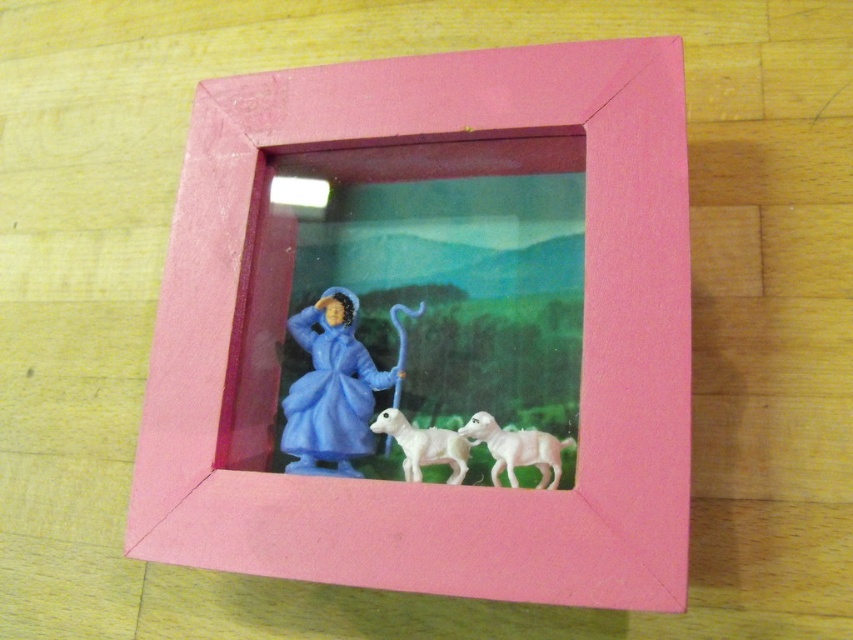
Describe the element at coordinates (289, 285) in the screenshot. I see `pink wood frame at center` at that location.

Is pink wood frame at center to the left of blue plastic figurine at center from the viewer's perspective?

Incorrect, pink wood frame at center is not on the left side of blue plastic figurine at center.

Find the location of a particular element. Image resolution: width=853 pixels, height=640 pixels. pink wood frame at center is located at coordinates (289, 285).

Where is `pink wood frame at center`? The height and width of the screenshot is (640, 853). pink wood frame at center is located at coordinates (289, 285).

Between blue plastic figurine at center and white glossy sheep at lower center, which one appears on the right side from the viewer's perspective?

From the viewer's perspective, white glossy sheep at lower center appears more on the right side.

Is blue plastic figurine at center further to camera compared to white glossy sheep at lower center?

Yes, blue plastic figurine at center is behind white glossy sheep at lower center.

Is point (374, 371) more distant than point (531, 428)?

That is True.

At what (x,y) coordinates should I click in order to perform the action: click on blue plastic figurine at center. Please return your answer as a coordinate pair (x, y). Looking at the image, I should click on (332, 388).

Is pink wood frame at center thinner than white glossy sheep at lower center?

No.

Does pink wood frame at center have a lesser height compared to white glossy sheep at lower center?

No.

Who is more distant from viewer, (x=300, y=520) or (x=465, y=432)?

The point (x=465, y=432) is behind.

Where is `pink wood frame at center`? The height and width of the screenshot is (640, 853). pink wood frame at center is located at coordinates (289, 285).